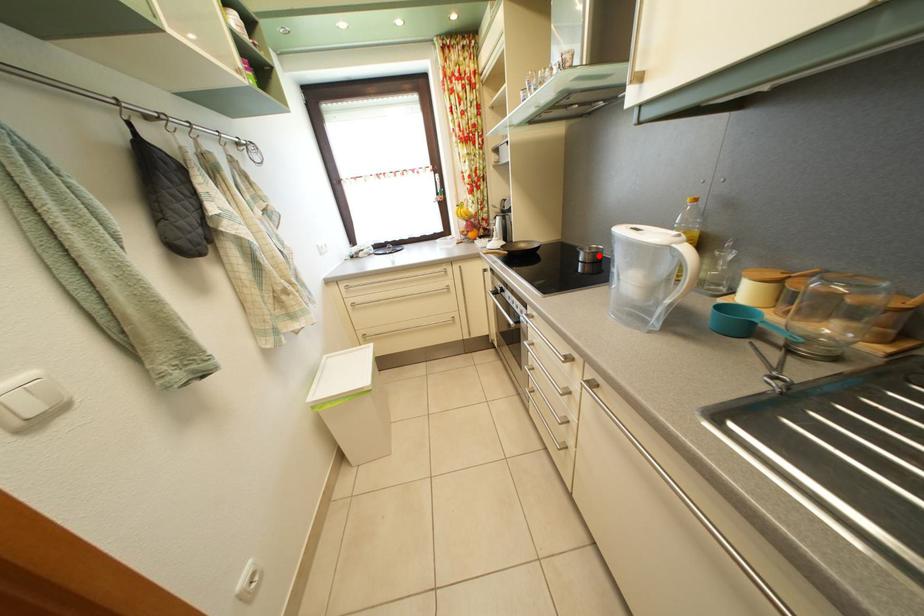
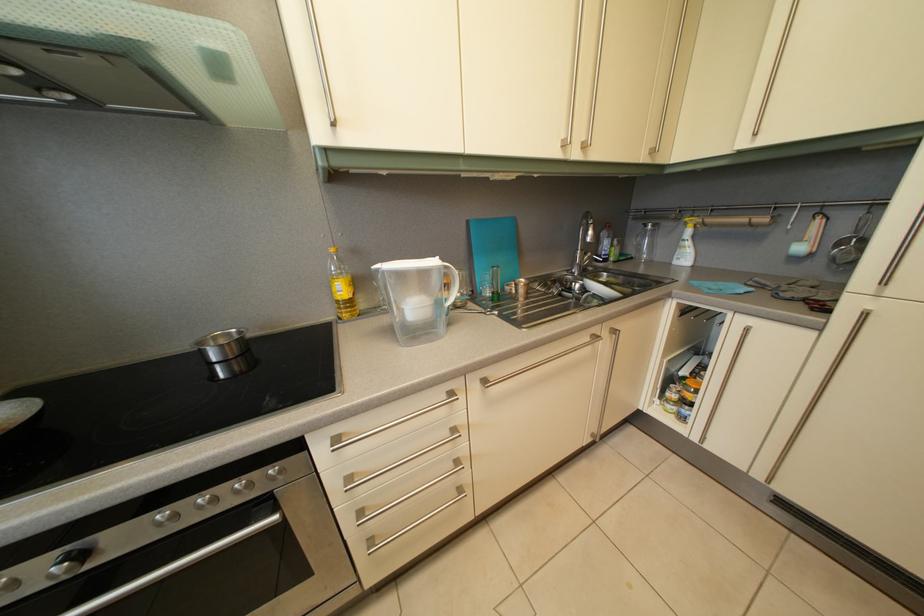
Question: I am providing you with two images of the same scene from different viewpoints. A red point is marked on the first image. At the location where the point appears in image 1, is it still visible in image 2?

Choices:
 (A) Yes
 (B) No

Answer: (A)